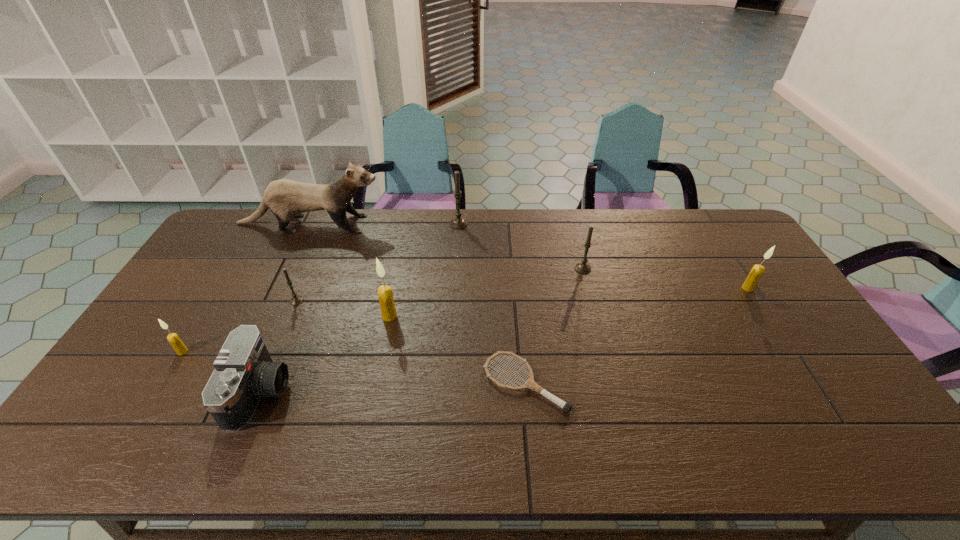
Point out which cream candle is positioned as the nearest to the nearest candle. Please provide its 2D coordinates. Your answer should be formatted as a tuple, i.e. [(x, y)], where the tuple contains the x and y coordinates of a point satisfying the conditions above.

[(385, 295)]

The image size is (960, 540). In order to click on free spot that satisfies the following two spatial constraints: 1. on the face of the gray ferret; 2. on the left side of the rightmost candle in this screenshot , I will do `click(280, 288)`.

Where is `free space that satisfies the following two spatial constraints: 1. on the face of the ferret; 2. on the right side of the second nearest candle`? free space that satisfies the following two spatial constraints: 1. on the face of the ferret; 2. on the right side of the second nearest candle is located at coordinates (267, 316).

Find the location of `vacant area in the image that satisfies the following two spatial constraints: 1. on the back side of the second nearest gray candle; 2. on the left side of the smallest gray candle`. vacant area in the image that satisfies the following two spatial constraints: 1. on the back side of the second nearest gray candle; 2. on the left side of the smallest gray candle is located at coordinates (310, 268).

At what (x,y) coordinates should I click in order to perform the action: click on free spot that satisfies the following two spatial constraints: 1. on the back side of the second farthest gray candle; 2. on the face of the ferret. Please return your answer as a coordinate pair (x, y). This screenshot has width=960, height=540. Looking at the image, I should click on pyautogui.click(x=571, y=224).

Where is `free space that satisfies the following two spatial constraints: 1. on the back side of the fourth candle from right to left; 2. on the right side of the farthest candle`? Image resolution: width=960 pixels, height=540 pixels. free space that satisfies the following two spatial constraints: 1. on the back side of the fourth candle from right to left; 2. on the right side of the farthest candle is located at coordinates (408, 224).